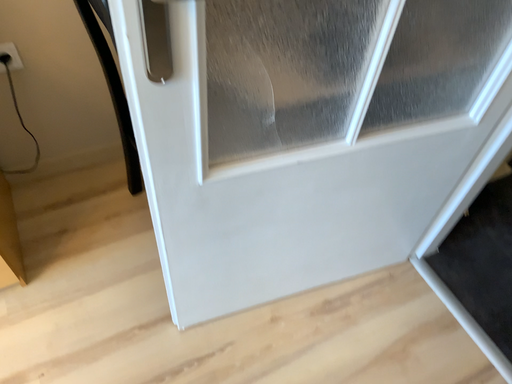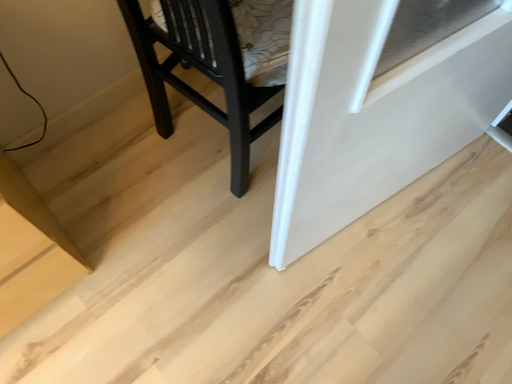
Question: How did the camera likely rotate when shooting the video?

Choices:
 (A) rotated right
 (B) rotated left

Answer: (A)